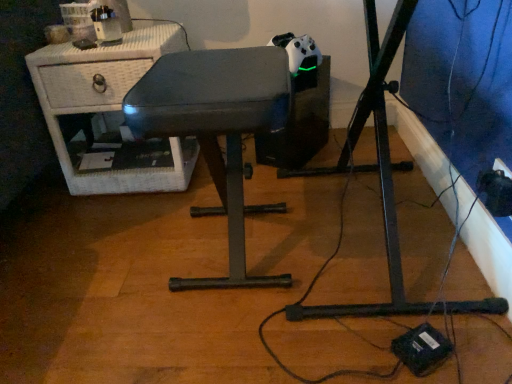
Locate an element on the screen. vacant area that is in front of metallic gray stool at center, which is counted as the first furniture, starting from the front is located at coordinates (202, 343).